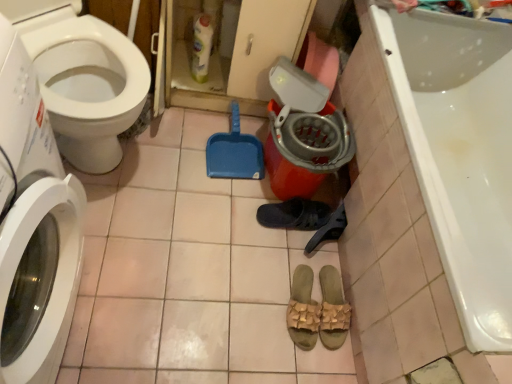
I want to click on white glossy toilet at left, so click(x=89, y=87).

Describe the element at coordinates (33, 226) in the screenshot. I see `white glossy washing machine at left` at that location.

What are the coordinates of `white glossy washing machine at left` in the screenshot? It's located at (33, 226).

Identify the location of orange plastic bucket at center. Image resolution: width=512 pixels, height=384 pixels. (306, 149).

In order to face translucent plastic bottle at upper center, should I rotate leftwards or rightwards?

Rotate left and turn 7.019 degrees.

Where is `black rubber shoe at center`? Image resolution: width=512 pixels, height=384 pixels. black rubber shoe at center is located at coordinates (329, 229).

What do you see at coordinates (329, 229) in the screenshot?
I see `black rubber shoe at center` at bounding box center [329, 229].

The image size is (512, 384). Describe the element at coordinates (333, 309) in the screenshot. I see `tan woven sandals at center, the first footwear when ordered from bottom to top` at that location.

The image size is (512, 384). What do you see at coordinates (188, 273) in the screenshot?
I see `pink tile at lower center` at bounding box center [188, 273].

Find the location of `white glossy toilet at left`. white glossy toilet at left is located at coordinates (89, 87).

From a real-world perspective, relative to black rubber shoe at center, is pink tile at lower center vertically above or below?

Clearly, from a real-world perspective, pink tile at lower center is below black rubber shoe at center.

Between pink tile at lower center and black rubber shoe at center, which one is positioned behind?

black rubber shoe at center.

Is pink tile at lower center at the left side of black rubber shoe at center?

Indeed, pink tile at lower center is positioned on the left side of black rubber shoe at center.

Consider the image. Could black rubber shoe at center be considered to be inside pink tile at lower center?

No, black rubber shoe at center is not inside pink tile at lower center.

Does point (290, 136) come farther from viewer compared to point (296, 303)?

Yes, it is behind point (296, 303).

At what (x,y) coordinates should I click in order to perform the action: click on potty that appears above the tan woven sandals at center, which ranks as the 2th footwear in bottom-to-top order (from a real-world perspective). Please return your answer as a coordinate pair (x, y). This screenshot has height=384, width=512. Looking at the image, I should click on (306, 149).

What's the angular difference between white glossy washing machine at left and black rubber shoe at center's facing directions?

The facing directions of white glossy washing machine at left and black rubber shoe at center are 126 degrees apart.

Can black rubber shoe at center be found inside white glossy washing machine at left?

No, black rubber shoe at center is not a part of white glossy washing machine at left.

Is white glossy washing machine at left facing away from black rubber shoe at center?

No, white glossy washing machine at left's orientation is not away from black rubber shoe at center.

From the picture: How far apart are white glossy washing machine at left and black rubber shoe at center?

white glossy washing machine at left and black rubber shoe at center are 35.71 inches apart from each other.

Is tan woven sandals at center, marked as the 3th footwear in a top-to-bottom arrangement, behind white glossy washing machine at left?

That is True.

Does tan woven sandals at center, marked as the 3th footwear in a top-to-bottom arrangement, have a lesser width compared to white glossy washing machine at left?

Yes, tan woven sandals at center, marked as the 3th footwear in a top-to-bottom arrangement, is thinner than white glossy washing machine at left.

Between tan woven sandals at center, marked as the 3th footwear in a top-to-bottom arrangement, and white glossy washing machine at left, which one has less height?

tan woven sandals at center, marked as the 3th footwear in a top-to-bottom arrangement, is shorter.

Find the location of a particular element. The width and height of the screenshot is (512, 384). bathtub below the translucent plastic bottle at upper center (from the image's perspective) is located at coordinates (460, 153).

Is point (459, 188) farther from viewer compared to point (197, 49)?

That is False.

Consider the image. From a real-world perspective, is white glossy bathtub at lower right above or below translucent plastic bottle at upper center?

In terms of real-world spatial position, white glossy bathtub at lower right is above translucent plastic bottle at upper center.

You are a GUI agent. You are given a task and a screenshot of the screen. Output one action in this format:
    pyautogui.click(x=<x>, y=<y>)
    Task: Click on the shoe lying above the tan woven sandals at center, the first footwear when ordered from bottom to top (from the image's perspective)
    This screenshot has height=384, width=512.
    Given the screenshot: What is the action you would take?
    pyautogui.click(x=329, y=229)

Looking at the image, does tan woven sandals at center, the first footwear when ordered from bottom to top, seem bigger or smaller compared to black rubber shoe at center?

Clearly, tan woven sandals at center, the first footwear when ordered from bottom to top, is smaller in size than black rubber shoe at center.

Does tan woven sandals at center, marked as the 3th footwear in a top-to-bottom arrangement, have a lesser height compared to black rubber shoe at center?

Yes.

Would you say tan woven sandals at center, the first footwear when ordered from bottom to top, is to the left or to the right of black rubber shoe at center in the picture?

In the image, tan woven sandals at center, the first footwear when ordered from bottom to top, appears on the left side of black rubber shoe at center.

In the image, there is a dark gray fabric slipper at center, which is counted as the 3th footwear, starting from the bottom. Identify the location of washing machine below it (from the image's perspective). This screenshot has width=512, height=384. (33, 226).

Could you tell me if dark gray fabric slipper at center, the 1th footwear in the top-to-bottom sequence, is turned towards white glossy washing machine at left?

No, dark gray fabric slipper at center, the 1th footwear in the top-to-bottom sequence, is not oriented towards white glossy washing machine at left.

Does dark gray fabric slipper at center, which is counted as the 3th footwear, starting from the bottom, come in front of white glossy washing machine at left?

No, it is behind white glossy washing machine at left.

Locate an element on the screen. tile directly beneath the black rubber shoe at center (from a real-world perspective) is located at coordinates (188, 273).

At what (x,y) coordinates should I click in order to perform the action: click on the 2nd footwear below when counting from the orange plastic bucket at center (from the image's perspective). Please return your answer as a coordinate pair (x, y). This screenshot has height=384, width=512. Looking at the image, I should click on (303, 310).

Based on their spatial positions, is tan woven sandals at center, the first footwear when ordered from bottom to top, or orange plastic bucket at center closer to pink tile at lower center?

Among the two, orange plastic bucket at center is located nearer to pink tile at lower center.

Which object lies nearer to the anchor point dark gray fabric slipper at center, the 1th footwear in the top-to-bottom sequence, tan woven sandals at center, which is the second footwear from top to bottom, or white glossy washing machine at left?

Based on the image, tan woven sandals at center, which is the second footwear from top to bottom, appears to be nearer to dark gray fabric slipper at center, the 1th footwear in the top-to-bottom sequence.

When comparing their distances from white glossy toilet at left, does dark gray fabric slipper at center, the 1th footwear in the top-to-bottom sequence, or white glossy bathtub at lower right seem further?

white glossy bathtub at lower right is further to white glossy toilet at left.

Considering their positions, is tan woven sandals at center, marked as the 3th footwear in a top-to-bottom arrangement, positioned further to dark gray fabric slipper at center, which is counted as the 3th footwear, starting from the bottom, than white glossy toilet at left?

Based on the image, white glossy toilet at left appears to be further to dark gray fabric slipper at center, which is counted as the 3th footwear, starting from the bottom.

Based on their spatial positions, is white glossy bathtub at lower right or translucent plastic bottle at upper center further from white glossy washing machine at left?

white glossy bathtub at lower right lies further to white glossy washing machine at left than the other object.

From the image, which object appears to be nearer to dark gray fabric slipper at center, the 1th footwear in the top-to-bottom sequence, white glossy washing machine at left or white glossy bathtub at lower right?

The object closer to dark gray fabric slipper at center, the 1th footwear in the top-to-bottom sequence, is white glossy bathtub at lower right.

Estimate the real-world distances between objects in this image. Which object is further from white glossy bathtub at lower right, dark gray fabric slipper at center, which is counted as the 3th footwear, starting from the bottom, or white glossy toilet at left?

white glossy toilet at left lies further to white glossy bathtub at lower right than the other object.

Estimate the real-world distances between objects in this image. Which object is further from tan woven sandals at center, which ranks as the 2th footwear in bottom-to-top order, pink tile at lower center or black rubber shoe at center?

Among the two, pink tile at lower center is located further to tan woven sandals at center, which ranks as the 2th footwear in bottom-to-top order.

Where is `footwear between pink tile at lower center and tan woven sandals at center, which is the second footwear from top to bottom`? footwear between pink tile at lower center and tan woven sandals at center, which is the second footwear from top to bottom is located at coordinates (294, 214).

Locate an element on the screen. This screenshot has height=384, width=512. bidet between white glossy washing machine at left and black rubber shoe at center in the front-back direction is located at coordinates (89, 87).

The width and height of the screenshot is (512, 384). Find the location of `tile between translucent plastic bottle at upper center and tan woven sandals at center, which ranks as the 2th footwear in bottom-to-top order, from top to bottom`. tile between translucent plastic bottle at upper center and tan woven sandals at center, which ranks as the 2th footwear in bottom-to-top order, from top to bottom is located at coordinates (188, 273).

Identify the location of shoe between dark gray fabric slipper at center, the 1th footwear in the top-to-bottom sequence, and tan woven sandals at center, marked as the 3th footwear in a top-to-bottom arrangement, in the vertical direction. (329, 229).